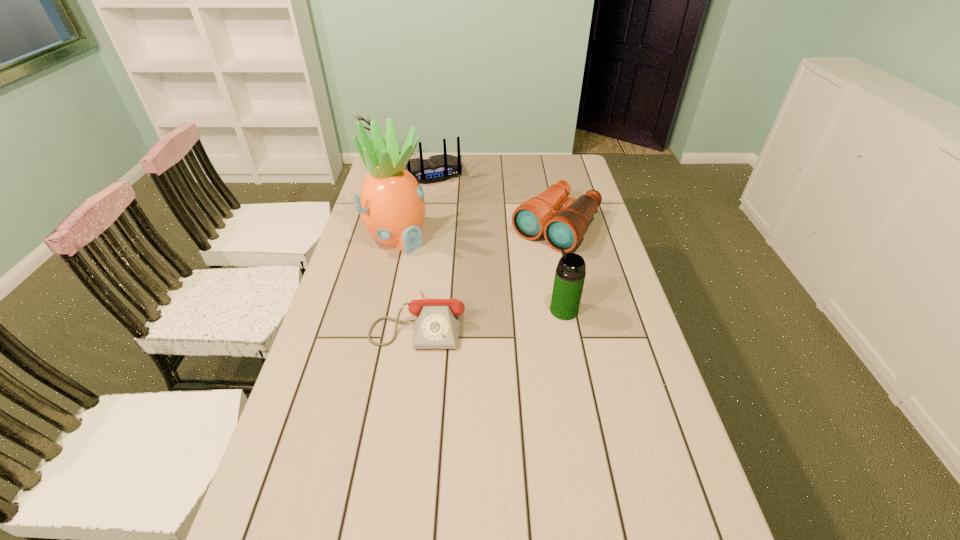
The height and width of the screenshot is (540, 960). Find the location of `vacant region located at the entrance of the pineapple`. vacant region located at the entrance of the pineapple is located at coordinates (478, 292).

Identify the location of vacant space located at the entrance of the pineapple. (437, 263).

Identify the location of vacant space located at the entrance of the pineapple. (451, 273).

The width and height of the screenshot is (960, 540). I want to click on vacant space positioned 0.060m through the lenses of the fourth tallest object, so click(x=526, y=262).

The width and height of the screenshot is (960, 540). In order to click on vacant space situated 0.090m through the lenses of the fourth tallest object in this screenshot , I will do `click(521, 267)`.

Locate an element on the screen. free location located through the lenses of the fourth tallest object is located at coordinates (527, 261).

The width and height of the screenshot is (960, 540). Identify the location of vacant space situated 0.100m on the back of the farthest object. (444, 201).

You are a GUI agent. You are given a task and a screenshot of the screen. Output one action in this format:
    pyautogui.click(x=<x>, y=<y>)
    Task: Click on the vacant space situated 0.380m on the back of the farthest object
    Image resolution: width=960 pixels, height=540 pixels.
    Given the screenshot: What is the action you would take?
    pyautogui.click(x=467, y=242)

Identify the location of free space located on the back of the farthest object. This screenshot has height=540, width=960. (460, 230).

I want to click on object located in the far edge section of the desktop, so click(437, 168).